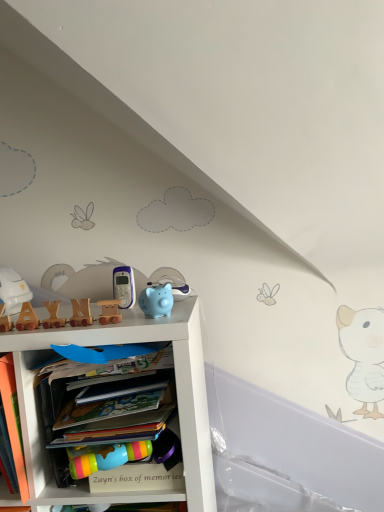
Question: Can you confirm if orange matte book at lower left is taller than wooden letter blocks at upper left, the sixth toy in the right-to-left sequence?

Choices:
 (A) no
 (B) yes

Answer: (B)

Question: Can wooden letter blocks at upper left, which is the 2th toy in left-to-right order, be found inside orange matte book at lower left?

Choices:
 (A) yes
 (B) no

Answer: (B)

Question: Considering the relative positions of orange matte book at lower left and wooden letter blocks at upper left, the sixth toy in the right-to-left sequence, in the image provided, is orange matte book at lower left to the left of wooden letter blocks at upper left, the sixth toy in the right-to-left sequence, from the viewer's perspective?

Choices:
 (A) no
 (B) yes

Answer: (B)

Question: Is orange matte book at lower left smaller than wooden letter blocks at upper left, which is the 2th toy in left-to-right order?

Choices:
 (A) yes
 (B) no

Answer: (B)

Question: Can you confirm if orange matte book at lower left is positioned to the right of wooden letter blocks at upper left, which is the 2th toy in left-to-right order?

Choices:
 (A) no
 (B) yes

Answer: (A)

Question: From a real-world perspective, does orange matte book at lower left stand above wooden letter blocks at upper left, which is the 2th toy in left-to-right order?

Choices:
 (A) no
 (B) yes

Answer: (A)

Question: From a real-world perspective, is matte plastic phone at center, the second toy viewed from the right, on top of wooden train at center, the third toy from the left?

Choices:
 (A) yes
 (B) no

Answer: (A)

Question: From the image's perspective, does matte plastic phone at center, the sixth toy viewed from the left, appear higher than wooden train at center, arranged as the fifth toy when viewed from the right?

Choices:
 (A) yes
 (B) no

Answer: (A)

Question: Is matte plastic phone at center, the second toy viewed from the right, not near wooden train at center, arranged as the fifth toy when viewed from the right?

Choices:
 (A) no
 (B) yes

Answer: (A)

Question: Does matte plastic phone at center, the second toy viewed from the right, appear on the left side of wooden train at center, the third toy from the left?

Choices:
 (A) yes
 (B) no

Answer: (B)

Question: From a real-world perspective, is matte plastic phone at center, the second toy viewed from the right, below wooden train at center, the third toy from the left?

Choices:
 (A) yes
 (B) no

Answer: (B)

Question: Is the depth of matte plastic phone at center, the second toy viewed from the right, greater than that of wooden train at center, the third toy from the left?

Choices:
 (A) no
 (B) yes

Answer: (B)

Question: Considering the relative sizes of white matte helmet at left, positioned as the 1th toy in left-to-right order, and matte blue piggy bank at center, positioned as the first toy in right-to-left order, in the image provided, is white matte helmet at left, positioned as the 1th toy in left-to-right order, bigger than matte blue piggy bank at center, positioned as the first toy in right-to-left order,?

Choices:
 (A) no
 (B) yes

Answer: (B)